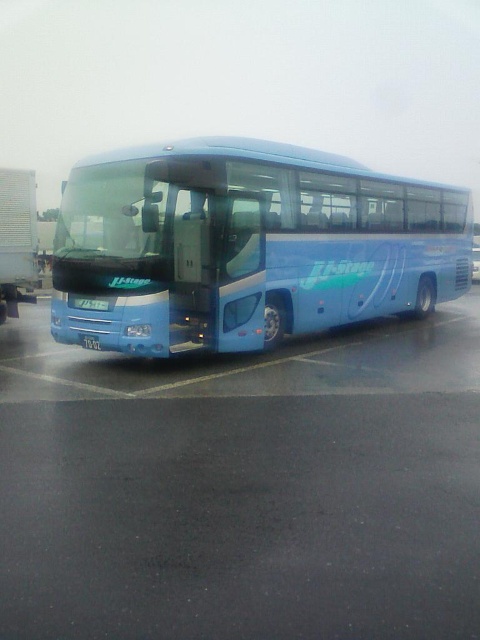
Question: Can you confirm if black asphalt parking lot at center is thinner than blue glossy bus at center?

Choices:
 (A) no
 (B) yes

Answer: (B)

Question: Which point is farther to the camera?

Choices:
 (A) white corrugated plastic trailer truck at left
 (B) black asphalt parking lot at center

Answer: (A)

Question: Is black asphalt parking lot at center smaller than white plastic license plate at center?

Choices:
 (A) yes
 (B) no

Answer: (B)

Question: Where is blue glossy bus at center located in relation to white corrugated plastic trailer truck at left in the image?

Choices:
 (A) left
 (B) right

Answer: (B)

Question: Which object is positioned farthest from the white corrugated plastic trailer truck at left?

Choices:
 (A) white plastic license plate at center
 (B) black asphalt parking lot at center
 (C) blue glossy bus at center

Answer: (B)

Question: Considering the real-world distances, which object is farthest from the blue glossy bus at center?

Choices:
 (A) black asphalt parking lot at center
 (B) white corrugated plastic trailer truck at left

Answer: (B)